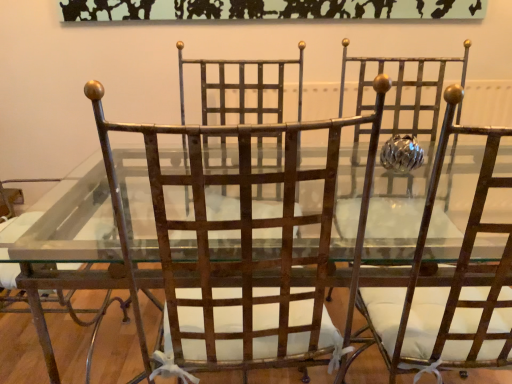
Question: Which direction should I rotate to look at rusty metal chair at center, acting as the 2th chair starting from the left, — up or down?

Choices:
 (A) up
 (B) down

Answer: (B)

Question: Is rusty metal chair at center, acting as the 2th chair starting from the left, positioned behind rusty metal chair at left, marked as the 3th chair in a right-to-left arrangement?

Choices:
 (A) yes
 (B) no

Answer: (B)

Question: From the image's perspective, is rusty metal chair at center, which is counted as the 2th chair, starting from the right, over rusty metal chair at left, marked as the 3th chair in a right-to-left arrangement?

Choices:
 (A) yes
 (B) no

Answer: (B)

Question: Does rusty metal chair at center, which is counted as the 2th chair, starting from the right, have a greater width compared to rusty metal chair at left, marked as the 3th chair in a right-to-left arrangement?

Choices:
 (A) no
 (B) yes

Answer: (A)

Question: Is rusty metal chair at center, which is counted as the 2th chair, starting from the right, outside of rusty metal chair at left, marked as the 3th chair in a right-to-left arrangement?

Choices:
 (A) yes
 (B) no

Answer: (A)

Question: Could rusty metal chair at left, marked as the 3th chair in a right-to-left arrangement, be considered to be inside rusty metal chair at center, acting as the 2th chair starting from the left?

Choices:
 (A) no
 (B) yes

Answer: (A)

Question: Does rusty metal chair at center, which is counted as the 2th chair, starting from the right, turn towards rusty metal chair at left, arranged as the 1th chair when viewed from the left?

Choices:
 (A) yes
 (B) no

Answer: (B)

Question: From a real-world perspective, is rusty metal chair at center, which is counted as the 2th chair, starting from the right, under rusty metal chair at center, which appears as the 3th chair when viewed from the left?

Choices:
 (A) yes
 (B) no

Answer: (A)

Question: Does rusty metal chair at center, acting as the 2th chair starting from the left, have a smaller size compared to rusty metal chair at center, which appears as the 3th chair when viewed from the left?

Choices:
 (A) yes
 (B) no

Answer: (A)

Question: Is the depth of rusty metal chair at center, acting as the 2th chair starting from the left, less than that of rusty metal chair at center, arranged as the 1th chair when viewed from the right?

Choices:
 (A) no
 (B) yes

Answer: (A)

Question: From the image's perspective, does rusty metal chair at center, which is counted as the 2th chair, starting from the right, appear higher than rusty metal chair at center, which appears as the 3th chair when viewed from the left?

Choices:
 (A) yes
 (B) no

Answer: (B)

Question: Is rusty metal chair at center, acting as the 2th chair starting from the left, looking in the opposite direction of rusty metal chair at center, arranged as the 1th chair when viewed from the right?

Choices:
 (A) yes
 (B) no

Answer: (B)

Question: Is rusty metal chair at center, acting as the 2th chair starting from the left, touching rusty metal chair at center, arranged as the 1th chair when viewed from the right?

Choices:
 (A) no
 (B) yes

Answer: (A)

Question: From the image's perspective, would you say rusty metal chair at center, arranged as the 1th chair when viewed from the right, is shown under rusty metal chair at center, acting as the 2th chair starting from the left?

Choices:
 (A) no
 (B) yes

Answer: (A)